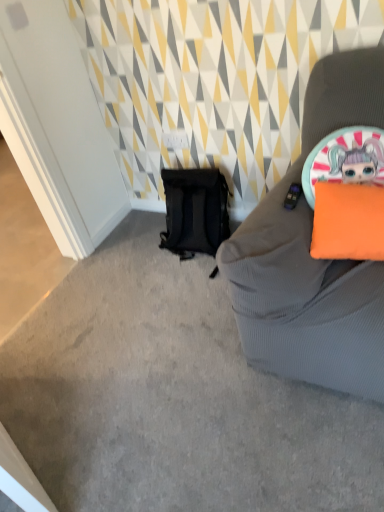
Question: Is orange fabric pillow at right to the left or to the right of black mesh backpack at lower left in the image?

Choices:
 (A) right
 (B) left

Answer: (A)

Question: Is point (372, 222) positioned closer to the camera than point (210, 192)?

Choices:
 (A) farther
 (B) closer

Answer: (B)

Question: Considering their positions, is orange fabric pillow at right located in front of or behind black mesh backpack at lower left?

Choices:
 (A) front
 (B) behind

Answer: (A)

Question: In terms of height, does black mesh backpack at lower left look taller or shorter compared to orange fabric pillow at right?

Choices:
 (A) tall
 (B) short

Answer: (A)

Question: Is black mesh backpack at lower left bigger or smaller than orange fabric pillow at right?

Choices:
 (A) big
 (B) small

Answer: (A)

Question: Considering the positions of point (215, 241) and point (329, 222), is point (215, 241) closer or farther from the camera than point (329, 222)?

Choices:
 (A) farther
 (B) closer

Answer: (A)

Question: From a real-world perspective, relative to orange fabric pillow at right, is black mesh backpack at lower left vertically above or below?

Choices:
 (A) above
 (B) below

Answer: (B)